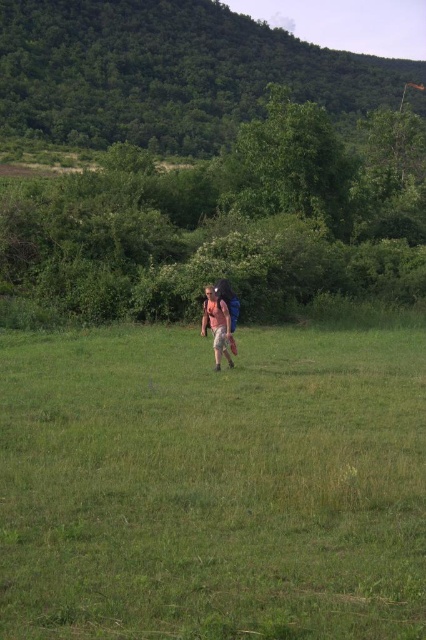
You are planning to set up a picnic in the grassy field shown in the image. You need to place a picnic blanket on the green grass at center. However, there is a light pink fabric backpack at center that might block the area. Based on the scene description, can you determine if the backpack is taller than the grass? If so, would placing the blanket under the backpack be possible without the backpack sinking into the grass?

The green grass at center is not as tall as the light pink fabric backpack at center, meaning the backpack is taller than the grass. Therefore, placing the picnic blanket under the backpack would be possible since the backpack is elevated above the grass and won

You are standing at the point marked by the coordinate point (x=167, y=72) in the image. Which direction should you walk to reach the green leafy hillside at upper center?

The green leafy hillside at upper center is located at the point marked by the coordinate point (x=167, y=72), so you are already at the green leafy hillside at upper center.

You are planning a hiking trip and want to ensure your backpack won t be too big compared to the landmarks in the area. Given the scene described, would the light pink fabric backpack at center appear smaller than the green leafy hillside at upper center in the image?

Yes, the light pink fabric backpack at center appears smaller than the green leafy hillside at upper center in the image, as the green leafy hillside at upper center is larger in size according to the description.